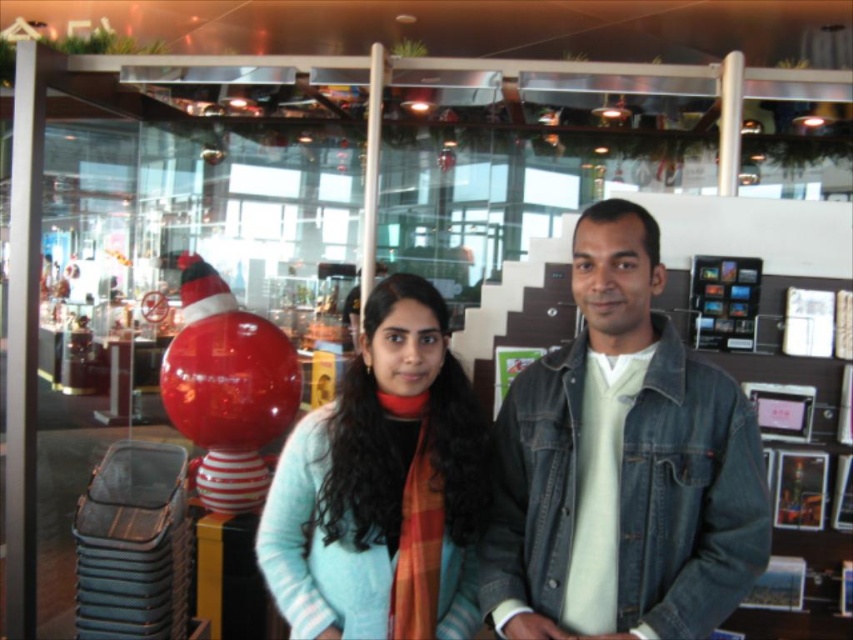
Question: From the image, what is the correct spatial relationship of denim jacket at center in relation to glossy red balloon at center?

Choices:
 (A) left
 (B) right

Answer: (B)

Question: Does denim jacket at center come behind glossy red balloon at center?

Choices:
 (A) yes
 (B) no

Answer: (B)

Question: Is denim jacket at center below glossy red balloon at center?

Choices:
 (A) yes
 (B) no

Answer: (B)

Question: Which object is the farthest from the glossy red balloon at center?

Choices:
 (A) light blue sweater at center
 (B) denim jacket at center

Answer: (B)

Question: Which of the following is the farthest from the observer?

Choices:
 (A) (537, 481)
 (B) (287, 356)
 (C) (427, 486)

Answer: (B)

Question: Estimate the real-world distances between objects in this image. Which object is farther from the glossy red balloon at center?

Choices:
 (A) light blue sweater at center
 (B) denim jacket at center

Answer: (B)